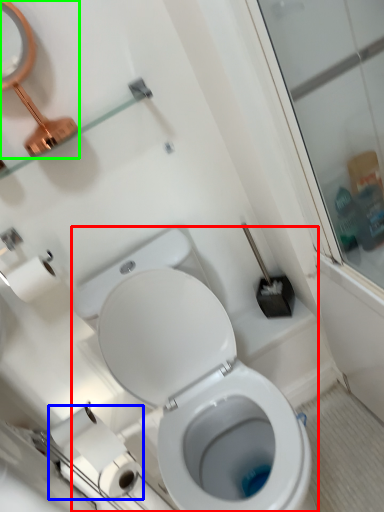
Question: Which object is positioned closest to toilet (highlighted by a red box)? Select from toilet paper (highlighted by a blue box) and mirror (highlighted by a green box).

Choices:
 (A) toilet paper
 (B) mirror

Answer: (A)